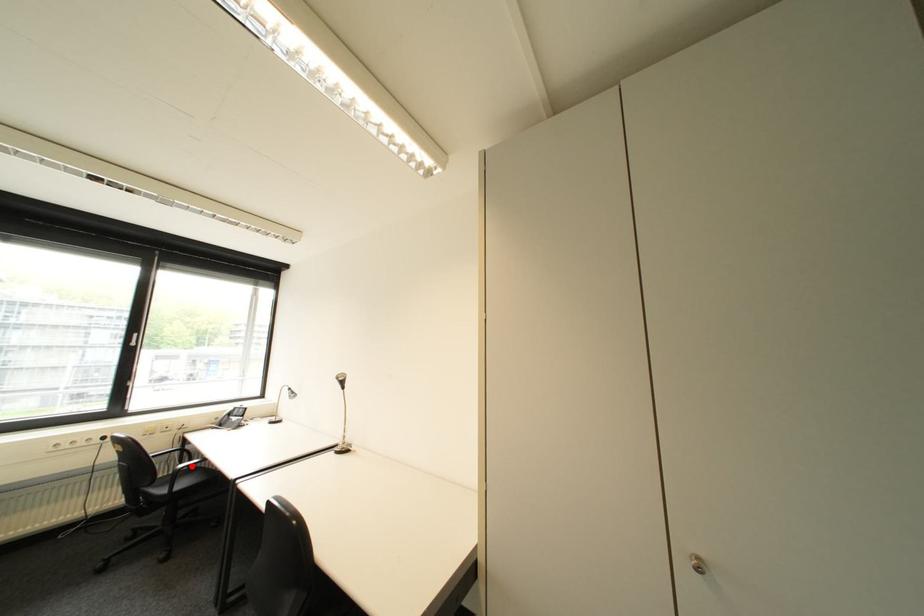
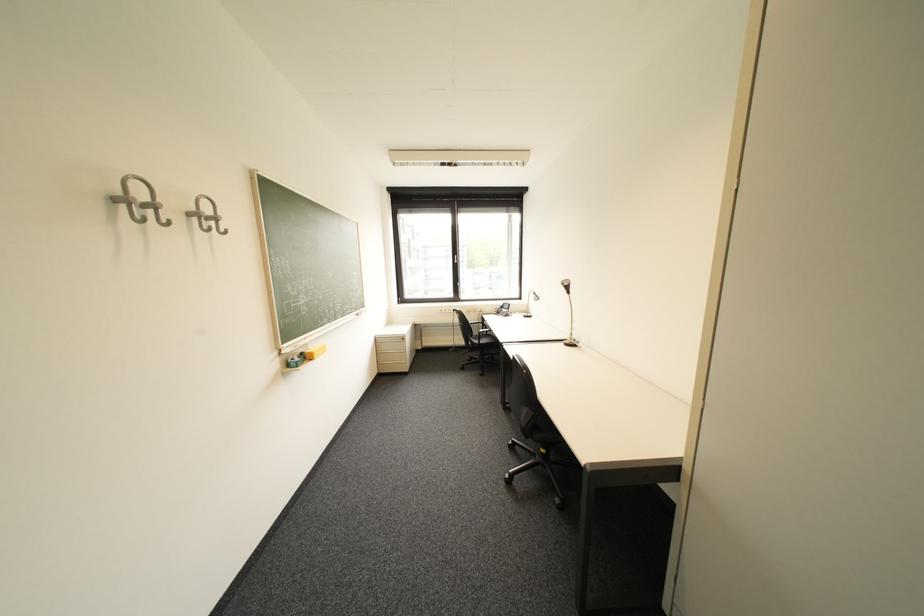
In the second image, find the point that corresponds to the highlighted location in the first image.

(492, 331)